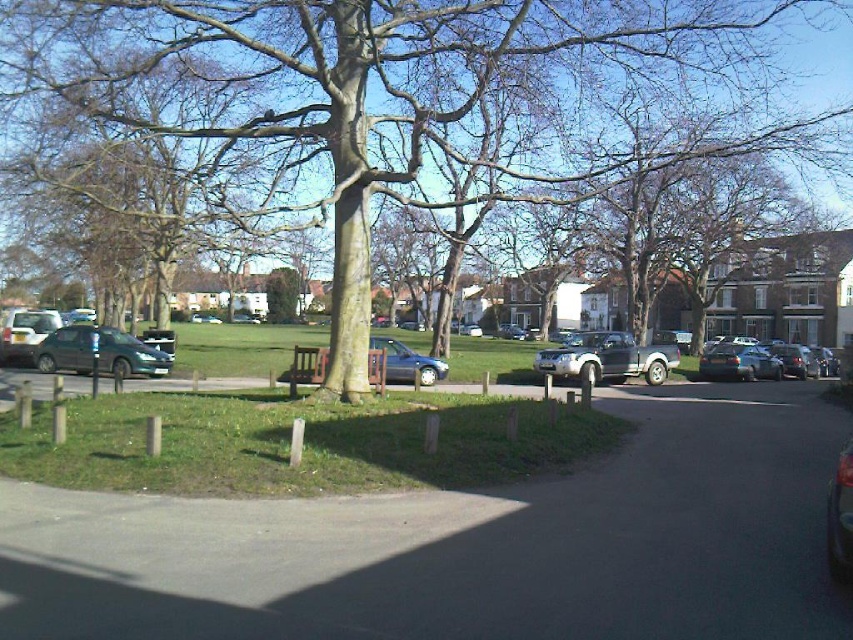
You are a delivery person needing to park your vehicle in the suburban area shown. You have a shiny silver sedan at center right and a satin silver suv at center. Which vehicle should you choose to park closer to the center of the area?

The satin silver suv at center is already positioned at the center of the area, so choosing to park the satin silver suv at center would place it closer to the center compared to the shiny silver sedan at center right which is farther away.

You are a delivery person trying to park your silver metallic pickup truck at center and satin silver suv at center in a parking lot with limited space. Which vehicle should you park first to maximize space efficiency?

The silver metallic pickup truck at center is smaller than the satin silver suv at center, so you should park the silver metallic pickup truck at center first to leave more space for the larger satin silver suv at center.